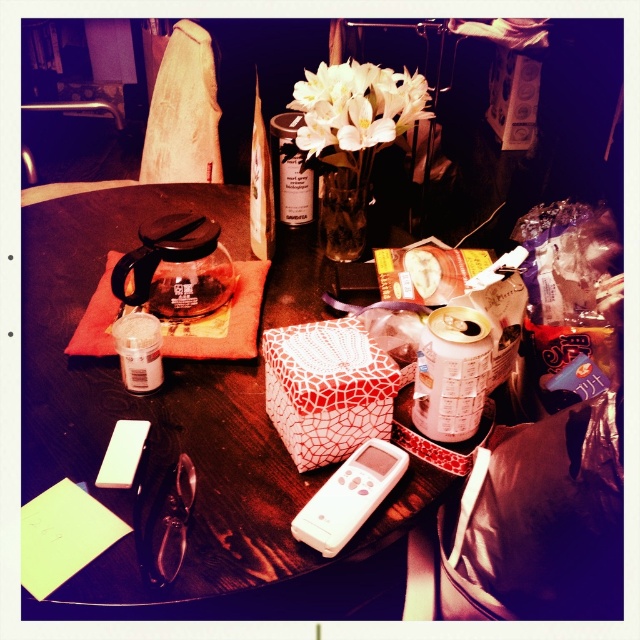
Question: Is transparent glass teapot at upper left behind white plastic remote at center?

Choices:
 (A) no
 (B) yes

Answer: (B)

Question: Is transparent glass teapot at upper left smaller than matte black spray can at center?

Choices:
 (A) yes
 (B) no

Answer: (A)

Question: Based on their relative distances, which object is nearer to the transparent glass teapot at upper left?

Choices:
 (A) matte black spray can at center
 (B) wooden table at center
 (C) white plastic remote at center
 (D) clear glass vase at upper center

Answer: (B)

Question: Which object appears closest to the camera in this image?

Choices:
 (A) wooden table at center
 (B) clear glass vase at upper center
 (C) transparent glass teapot at upper left
 (D) white glossy flowers at center

Answer: (A)

Question: From the image, what is the correct spatial relationship of wooden table at center in relation to clear glass vase at upper center?

Choices:
 (A) right
 (B) left

Answer: (B)

Question: Which object is farther from the camera taking this photo?

Choices:
 (A) matte black spray can at center
 (B) white glossy flowers at center
 (C) wooden table at center
 (D) clear glass vase at upper center

Answer: (A)